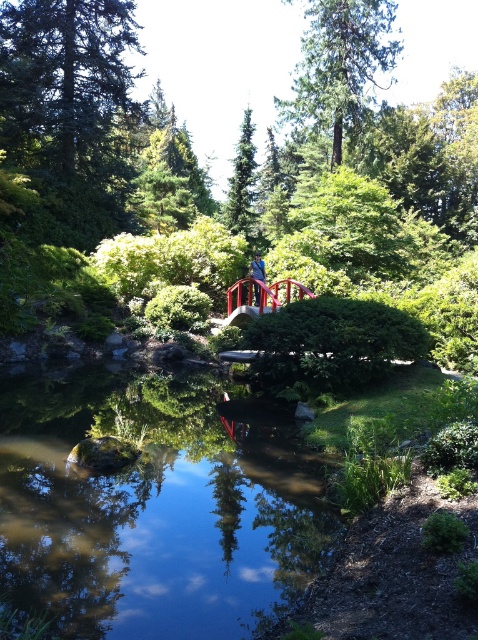
Question: Considering the real-world distances, which object is farthest from the green matte tree at upper left?

Choices:
 (A) green textured tree at upper center
 (B) smooth red bridge at center

Answer: (B)

Question: Estimate the real-world distances between objects in this image. Which object is farther from the green textured tree at upper center?

Choices:
 (A) clear water at center
 (B) green matte tree at upper left

Answer: (A)

Question: Among these points, which one is farthest from the camera?

Choices:
 (A) (379, 60)
 (B) (263, 280)

Answer: (A)

Question: Is green textured tree at upper center to the left of smooth red bridge at center from the viewer's perspective?

Choices:
 (A) no
 (B) yes

Answer: (A)

Question: Is green matte evergreen tree at center to the left of metallic red bridge at center from the viewer's perspective?

Choices:
 (A) no
 (B) yes

Answer: (B)

Question: Can you confirm if clear water at center is bigger than green textured tree at upper center?

Choices:
 (A) no
 (B) yes

Answer: (A)